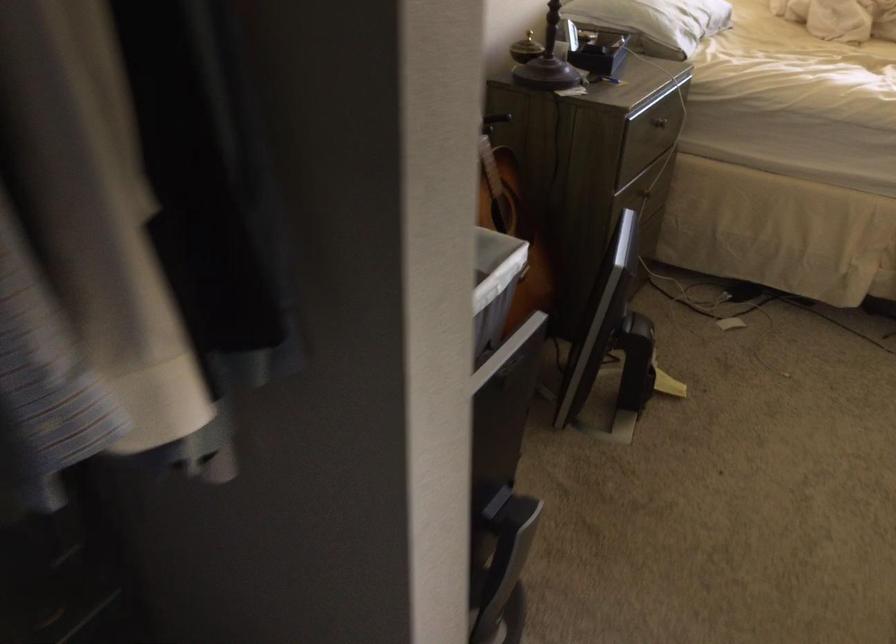
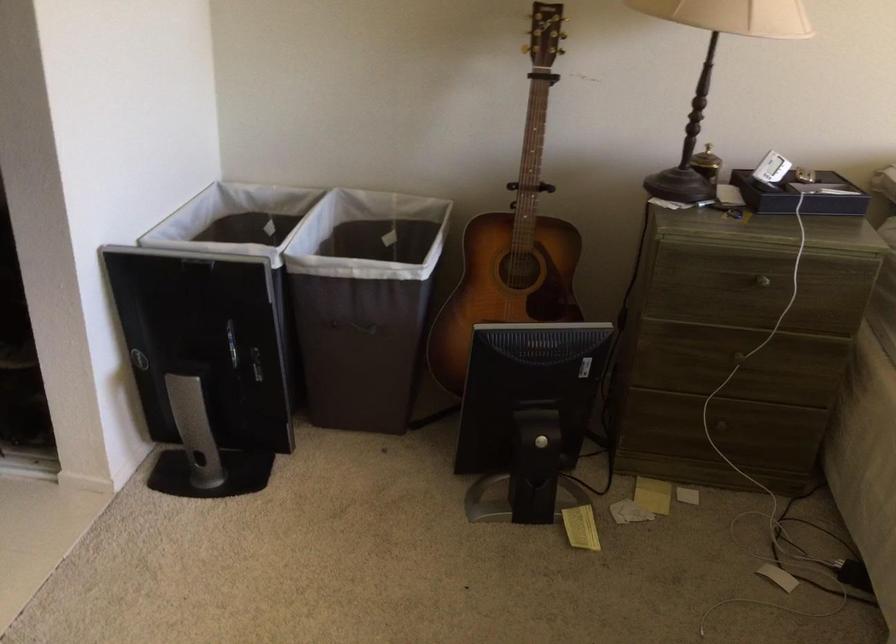
Where in the second image is the point corresponding to pixel 501 509 from the first image?

(203, 365)